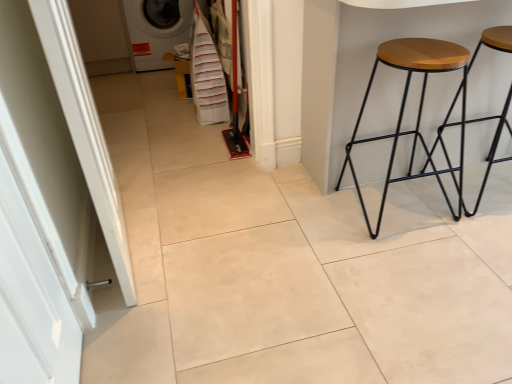
Image resolution: width=512 pixels, height=384 pixels. I want to click on wooden seat stool at right, which appears as the second stool when viewed from the left, so click(490, 144).

What do you see at coordinates (490, 144) in the screenshot?
I see `wooden seat stool at right, which ranks as the 1th stool in right-to-left order` at bounding box center [490, 144].

Identify the location of white glossy washing machine at upper left. (156, 30).

This screenshot has height=384, width=512. Identify the location of white fabric laundry at center. (207, 74).

At what (x,y) coordinates should I click in order to perform the action: click on wooden stool at right. Please return your answer as a coordinate pair (x, y). Looking at the image, I should click on (365, 65).

How much distance is there between wooden seat stool at right, which ranks as the 1th stool in right-to-left order, and white glossy door at left?

wooden seat stool at right, which ranks as the 1th stool in right-to-left order, and white glossy door at left are 5.29 feet apart.

Does wooden seat stool at right, which ranks as the 1th stool in right-to-left order, have a smaller size compared to white glossy door at left?

No, wooden seat stool at right, which ranks as the 1th stool in right-to-left order, is not smaller than white glossy door at left.

From the image's perspective, between wooden seat stool at right, which ranks as the 1th stool in right-to-left order, and white glossy door at left, who is located below?

white glossy door at left appears lower in the image.

Is white glossy door at left completely or partially inside wooden seat stool at right, which appears as the second stool when viewed from the left?

That's incorrect, white glossy door at left is not inside wooden seat stool at right, which appears as the second stool when viewed from the left.

Does wooden stool at right appear on the right side of wooden/black metal stool at right, which is counted as the 1th stool, starting from the left?

In fact, wooden stool at right is to the left of wooden/black metal stool at right, which is counted as the 1th stool, starting from the left.

Is wooden stool at right positioned before wooden/black metal stool at right, which is counted as the 1th stool, starting from the left?

Yes, it is.

Is wooden stool at right facing away from wooden/black metal stool at right, which is counted as the 1th stool, starting from the left?

wooden stool at right does not have its back to wooden/black metal stool at right, which is counted as the 1th stool, starting from the left.

From a real-world perspective, does wooden stool at right sit lower than wooden/black metal stool at right, the 2th stool when ordered from right to left?

No, from a real-world perspective, wooden stool at right is not under wooden/black metal stool at right, the 2th stool when ordered from right to left.

Can you see wooden stool at right touching white fabric laundry at center?

wooden stool at right is not next to white fabric laundry at center, and they're not touching.

Locate an element on the screen. This screenshot has width=512, height=384. table lying in front of the white fabric laundry at center is located at coordinates (365, 65).

Considering the positions of objects wooden stool at right and white fabric laundry at center in the image provided, who is in front, wooden stool at right or white fabric laundry at center?

wooden stool at right is closer to the camera.

Which point is more distant from viewer, [397,15] or [224,85]?

Point [224,85]

Does white glossy door at left have a smaller size compared to white fabric laundry at center?

Correct, white glossy door at left occupies less space than white fabric laundry at center.

The width and height of the screenshot is (512, 384). Identify the location of laundry on the right of white glossy door at left. click(207, 74).

From the image's perspective, is white glossy door at left on white fabric laundry at center?

No, from the image's perspective, white glossy door at left is not over white fabric laundry at center.

From a real-world perspective, between white glossy door at left and white fabric laundry at center, who is vertically higher?

white glossy door at left, from a real-world perspective.

Is point (151, 42) closer to viewer compared to point (386, 25)?

No.

Which object is wider, white glossy washing machine at upper left or wooden stool at right?

With larger width is wooden stool at right.

From the picture: Which of these two, white glossy washing machine at upper left or wooden stool at right, stands taller?

Standing taller between the two is wooden stool at right.

Is white glossy washing machine at upper left looking in the opposite direction of wooden stool at right?

No, wooden stool at right is not at the back of white glossy washing machine at upper left.

Looking at this image, from a real-world perspective, between white glossy washing machine at upper left and wooden seat stool at right, which appears as the second stool when viewed from the left, who is vertically higher?

In real-world perspective, wooden seat stool at right, which appears as the second stool when viewed from the left, is above.

I want to click on washing machine above the wooden seat stool at right, which appears as the second stool when viewed from the left (from the image's perspective), so click(156, 30).

Is white glossy washing machine at upper left closer to camera compared to wooden seat stool at right, which appears as the second stool when viewed from the left?

That is False.

How different are the orientations of white glossy washing machine at upper left and wooden seat stool at right, which ranks as the 1th stool in right-to-left order, in degrees?

178 degrees separate the facing orientations of white glossy washing machine at upper left and wooden seat stool at right, which ranks as the 1th stool in right-to-left order.

Is wooden seat stool at right, which appears as the second stool when viewed from the left, directly adjacent to wooden/black metal stool at right, which is counted as the 1th stool, starting from the left?

No.

From the picture: Considering the sizes of wooden seat stool at right, which ranks as the 1th stool in right-to-left order, and wooden/black metal stool at right, the 2th stool when ordered from right to left, in the image, is wooden seat stool at right, which ranks as the 1th stool in right-to-left order, bigger or smaller than wooden/black metal stool at right, the 2th stool when ordered from right to left,?

Considering their sizes, wooden seat stool at right, which ranks as the 1th stool in right-to-left order, takes up less space than wooden/black metal stool at right, the 2th stool when ordered from right to left.

Is point (498, 117) closer or farther from the camera than point (457, 46)?

Clearly, point (498, 117) is more distant from the camera than point (457, 46).

Can you confirm if wooden seat stool at right, which appears as the second stool when viewed from the left, is positioned to the left of wooden/black metal stool at right, the 2th stool when ordered from right to left?

No, wooden seat stool at right, which appears as the second stool when viewed from the left, is not to the left of wooden/black metal stool at right, the 2th stool when ordered from right to left.

Find the location of a particular element. screen door in front of the wooden seat stool at right, which ranks as the 1th stool in right-to-left order is located at coordinates (50, 195).

Image resolution: width=512 pixels, height=384 pixels. Identify the location of the 2nd stool positioned below the wooden stool at right (from the image's perspective). (418, 110).

Which object lies further to the anchor point white glossy washing machine at upper left, white glossy door at left or wooden/black metal stool at right, which is counted as the 1th stool, starting from the left?

white glossy door at left is further to white glossy washing machine at upper left.

Considering their positions, is white fabric laundry at center positioned closer to white glossy washing machine at upper left than wooden/black metal stool at right, which is counted as the 1th stool, starting from the left?

Based on the image, white fabric laundry at center appears to be nearer to white glossy washing machine at upper left.

When comparing their distances from wooden seat stool at right, which appears as the second stool when viewed from the left, does white glossy door at left or white glossy washing machine at upper left seem closer?

white glossy door at left is closer to wooden seat stool at right, which appears as the second stool when viewed from the left.

Looking at this image, which object lies nearer to the anchor point white glossy door at left, wooden seat stool at right, which appears as the second stool when viewed from the left, or wooden/black metal stool at right, which is counted as the 1th stool, starting from the left?

Based on the image, wooden/black metal stool at right, which is counted as the 1th stool, starting from the left, appears to be nearer to white glossy door at left.

When comparing their distances from wooden stool at right, does wooden seat stool at right, which ranks as the 1th stool in right-to-left order, or white glossy washing machine at upper left seem further?

white glossy washing machine at upper left is positioned further to the anchor wooden stool at right.

In the scene shown: When comparing their distances from wooden stool at right, does wooden seat stool at right, which ranks as the 1th stool in right-to-left order, or white fabric laundry at center seem closer?

wooden seat stool at right, which ranks as the 1th stool in right-to-left order, is positioned closer to the anchor wooden stool at right.

From the image, which object appears to be nearer to wooden stool at right, white fabric laundry at center or white glossy door at left?

white fabric laundry at center is positioned closer to the anchor wooden stool at right.

Based on the photo, when comparing their distances from wooden/black metal stool at right, the 2th stool when ordered from right to left, does white fabric laundry at center or wooden stool at right seem further?

white fabric laundry at center is positioned further to the anchor wooden/black metal stool at right, the 2th stool when ordered from right to left.

What are the coordinates of `stool between wooden stool at right and wooden/black metal stool at right, the 2th stool when ordered from right to left, in the up-down direction` in the screenshot? It's located at (490, 144).

Find the location of a particular element. This screenshot has width=512, height=384. laundry located between wooden stool at right and white glossy washing machine at upper left in the depth direction is located at coordinates (207, 74).

At what (x,y) coordinates should I click in order to perform the action: click on table located between white fabric laundry at center and wooden seat stool at right, which appears as the second stool when viewed from the left, in the left-right direction. Please return your answer as a coordinate pair (x, y). This screenshot has height=384, width=512. Looking at the image, I should click on (365, 65).

Identify the location of table between white glossy door at left and white glossy washing machine at upper left from front to back. The width and height of the screenshot is (512, 384). (365, 65).